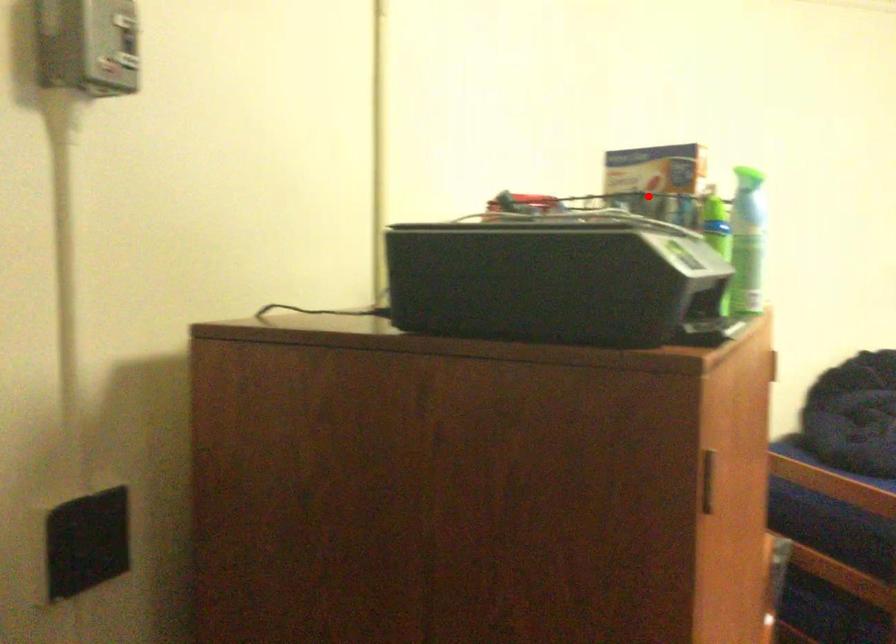
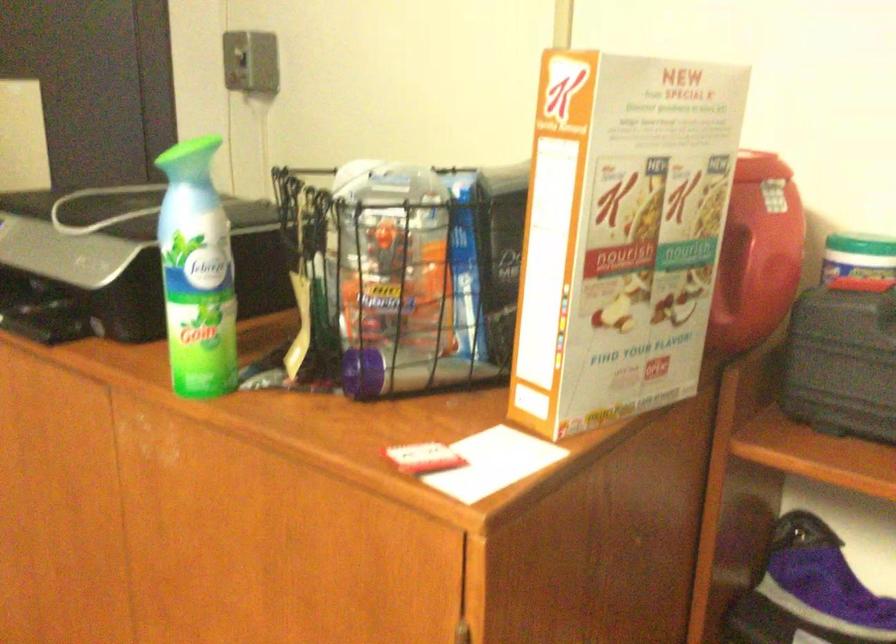
Question: I am providing you with two images of the same scene from different viewpoints. Image1 has a red point marked. In image2, the corresponding 3D location appears at what relative position? Reply with the corresponding letter.

Choices:
 (A) Closer
 (B) Farther

Answer: (A)